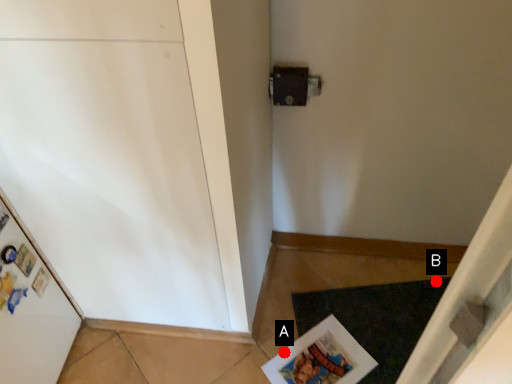
Question: Two points are circled on the image, labeled by A and B beside each circle. Which point is farther to the camera?

Choices:
 (A) A is further
 (B) B is further

Answer: (B)